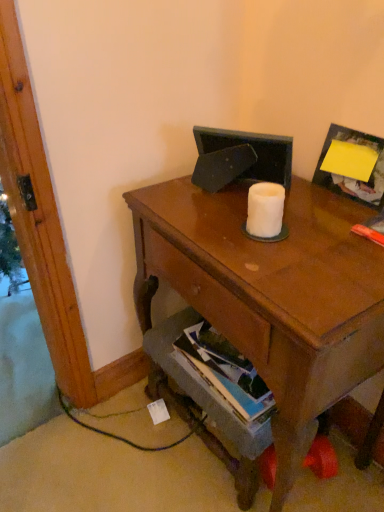
At what (x,y) coordinates should I click in order to perform the action: click on vacant space in front of white matte toilet paper at center. Please return your answer as a coordinate pair (x, y). Looking at the image, I should click on (284, 270).